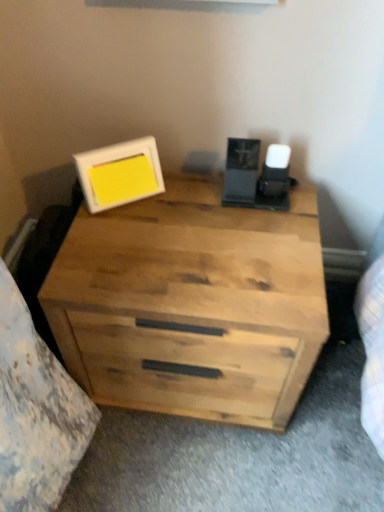
Question: Does white matte picture frame at upper left appear on the right side of natural wood chest of drawers at center?

Choices:
 (A) no
 (B) yes

Answer: (A)

Question: From a real-world perspective, does white matte picture frame at upper left stand above natural wood chest of drawers at center?

Choices:
 (A) yes
 (B) no

Answer: (A)

Question: Is natural wood chest of drawers at center inside white matte picture frame at upper left?

Choices:
 (A) no
 (B) yes

Answer: (A)

Question: Is white matte picture frame at upper left shorter than natural wood chest of drawers at center?

Choices:
 (A) no
 (B) yes

Answer: (B)

Question: Is white matte picture frame at upper left turned away from natural wood chest of drawers at center?

Choices:
 (A) yes
 (B) no

Answer: (B)

Question: From the image's perspective, is white matte picture frame at upper left above natural wood chest of drawers at center?

Choices:
 (A) no
 (B) yes

Answer: (B)

Question: Considering the relative sizes of natural wood chest of drawers at center and white matte picture frame at upper left in the image provided, is natural wood chest of drawers at center shorter than white matte picture frame at upper left?

Choices:
 (A) no
 (B) yes

Answer: (A)

Question: Considering the relative sizes of natural wood chest of drawers at center and white matte picture frame at upper left in the image provided, is natural wood chest of drawers at center bigger than white matte picture frame at upper left?

Choices:
 (A) no
 (B) yes

Answer: (B)

Question: Can you confirm if natural wood chest of drawers at center is positioned to the right of white matte picture frame at upper left?

Choices:
 (A) no
 (B) yes

Answer: (B)

Question: Is natural wood chest of drawers at center further to the viewer compared to white matte picture frame at upper left?

Choices:
 (A) yes
 (B) no

Answer: (B)

Question: From the image's perspective, is natural wood chest of drawers at center on white matte picture frame at upper left?

Choices:
 (A) no
 (B) yes

Answer: (A)

Question: Is white matte picture frame at upper left inside natural wood chest of drawers at center?

Choices:
 (A) no
 (B) yes

Answer: (A)

Question: Visually, is natural wood chest of drawers at center positioned to the left or to the right of white matte picture frame at upper left?

Choices:
 (A) left
 (B) right

Answer: (B)